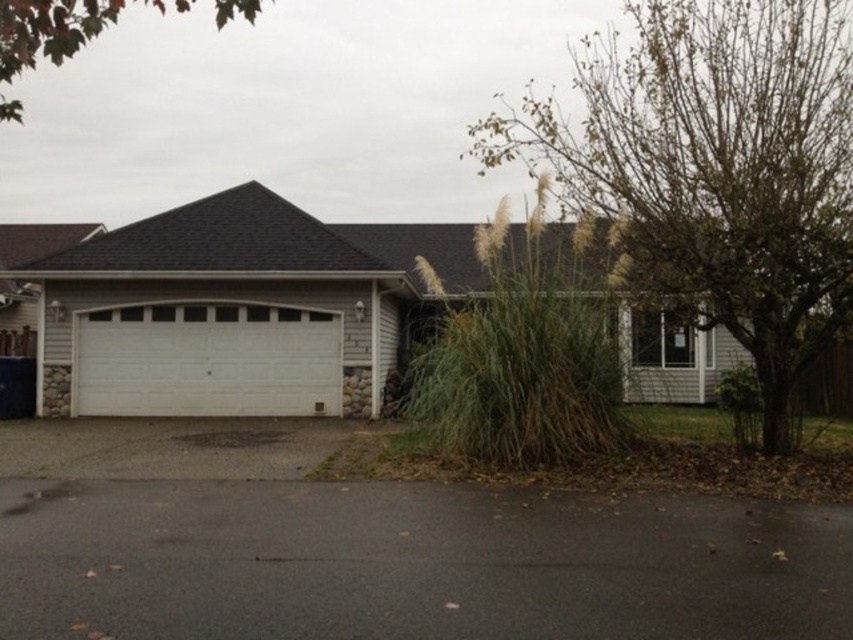
You are a delivery person with a 25 feet long ladder that needs to be placed between the green grass at lower right and the white painted wood garage at center. Can the ladder fit in that space?

The distance between the green grass at lower right and the white painted wood garage at center is 26.03 feet, which is longer than the 25 feet ladder. Therefore, the ladder can fit in that space.

From the picture: You are a delivery person approaching the house and need to park your vehicle. The garage is on the left side of the house. Where is the black asphalt driveway at lower center in relation to the garage?

The black asphalt driveway at lower center is located at point (410, 564), which is to the right of the garage door on the left side of the house.